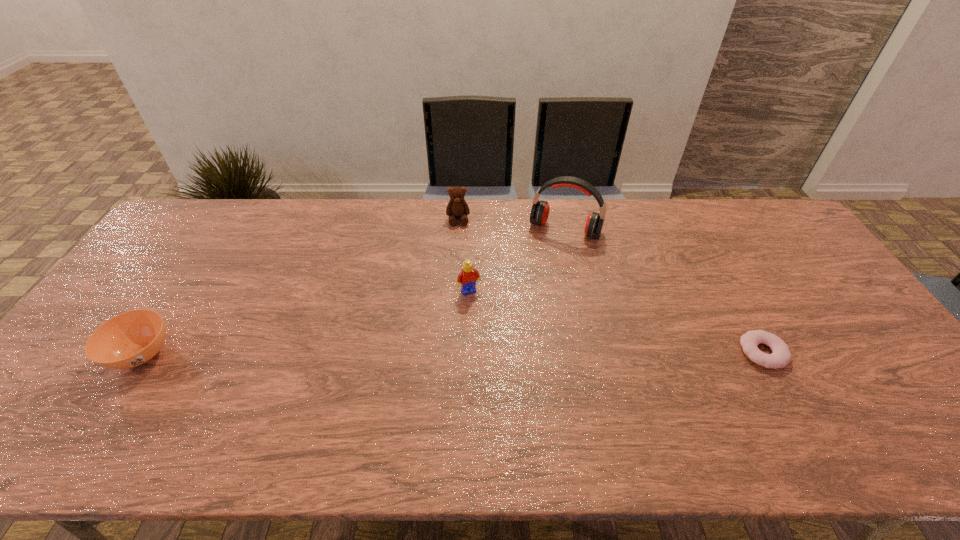
Find the location of a particular element. This screenshot has height=540, width=960. free area in between the fourth object from left to right and the fourth tallest object is located at coordinates (353, 292).

Image resolution: width=960 pixels, height=540 pixels. I want to click on vacant area that lies between the shortest object and the tallest object, so click(664, 291).

Locate an element on the screen. This screenshot has width=960, height=540. vacant region between the fourth tallest object and the doughnut is located at coordinates (452, 353).

Locate an element on the screen. vacant space in between the second object from right to left and the teddy bear is located at coordinates (512, 224).

Identify the location of vacant space that's between the rightmost object and the second object from right to left. Image resolution: width=960 pixels, height=540 pixels. (664, 291).

You are a GUI agent. You are given a task and a screenshot of the screen. Output one action in this format:
    pyautogui.click(x=<x>, y=<y>)
    Task: Click on the vacant area that lies between the third farthest object and the teddy bear
    The width and height of the screenshot is (960, 540).
    Given the screenshot: What is the action you would take?
    464,255

You are a GUI agent. You are given a task and a screenshot of the screen. Output one action in this format:
    pyautogui.click(x=<x>, y=<y>)
    Task: Click on the vacant area between the leftmost object and the doughnut
    Image resolution: width=960 pixels, height=540 pixels.
    Given the screenshot: What is the action you would take?
    pyautogui.click(x=452, y=353)

Find the location of `free space between the fourth tallest object and the third nearest object`. free space between the fourth tallest object and the third nearest object is located at coordinates (305, 323).

In order to click on blank region between the teddy bear and the third farthest object in this screenshot , I will do `click(464, 255)`.

You are a GUI agent. You are given a task and a screenshot of the screen. Output one action in this format:
    pyautogui.click(x=<x>, y=<y>)
    Task: Click on the object that stands as the second closest to the soup bowl
    
    Given the screenshot: What is the action you would take?
    pyautogui.click(x=457, y=207)